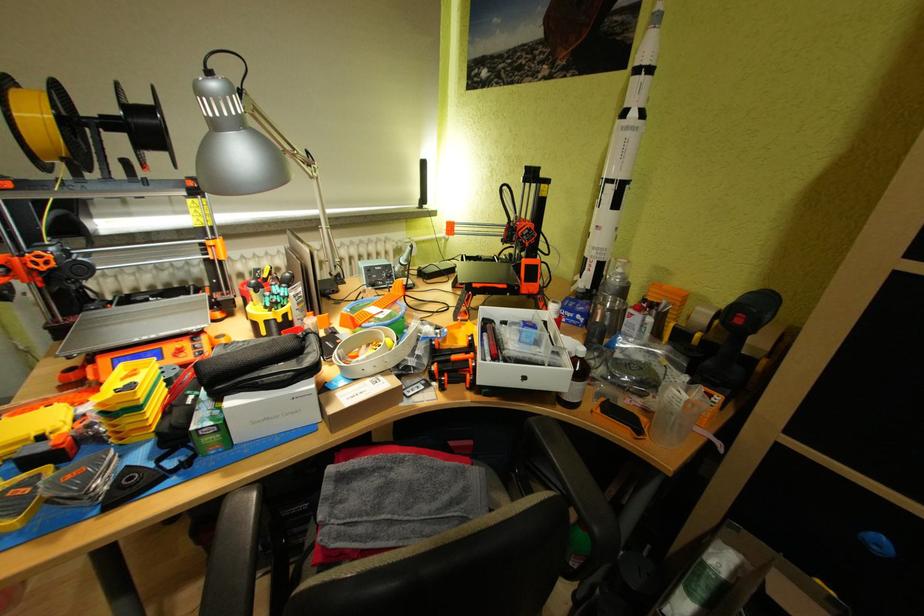
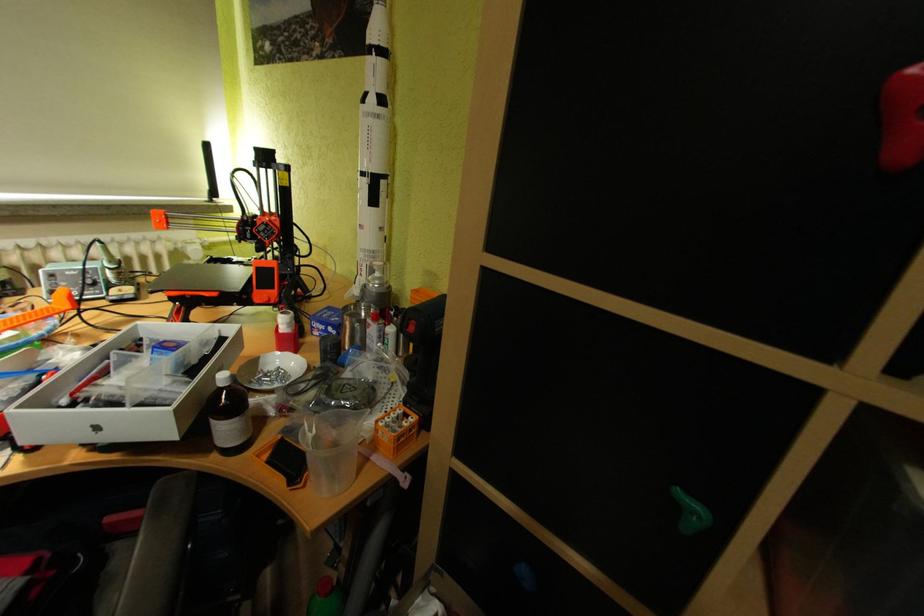
Question: What movement of the cameraman would produce the second image?

Choices:
 (A) Left
 (B) Right
 (C) Forward
 (D) Backward

Answer: (B)